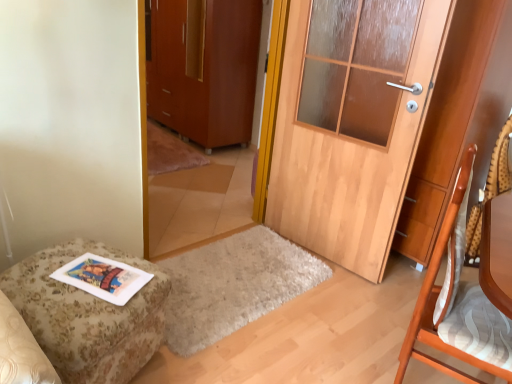
Question: Is wooden chair at right looking in the opposite direction of wooden textured swivel chair at right?

Choices:
 (A) yes
 (B) no

Answer: (B)

Question: Could you tell me if wooden chair at right is facing wooden textured swivel chair at right?

Choices:
 (A) yes
 (B) no

Answer: (B)

Question: Considering the relative sizes of wooden chair at right and wooden textured swivel chair at right in the image provided, is wooden chair at right smaller than wooden textured swivel chair at right?

Choices:
 (A) yes
 (B) no

Answer: (B)

Question: Is wooden chair at right at the right side of wooden textured swivel chair at right?

Choices:
 (A) yes
 (B) no

Answer: (B)

Question: From the image's perspective, does wooden chair at right appear higher than wooden textured swivel chair at right?

Choices:
 (A) no
 (B) yes

Answer: (A)

Question: Is wooden chair at right wider than wooden textured swivel chair at right?

Choices:
 (A) yes
 (B) no

Answer: (A)

Question: Is floral fabric ottoman at lower left next to wooden textured swivel chair at right and touching it?

Choices:
 (A) yes
 (B) no

Answer: (B)

Question: Is floral fabric ottoman at lower left facing away from wooden textured swivel chair at right?

Choices:
 (A) no
 (B) yes

Answer: (A)

Question: Can you confirm if floral fabric ottoman at lower left is positioned to the left of wooden textured swivel chair at right?

Choices:
 (A) no
 (B) yes

Answer: (B)

Question: From a real-world perspective, is floral fabric ottoman at lower left beneath wooden textured swivel chair at right?

Choices:
 (A) yes
 (B) no

Answer: (A)

Question: Does floral fabric ottoman at lower left have a larger size compared to wooden textured swivel chair at right?

Choices:
 (A) no
 (B) yes

Answer: (B)

Question: Is floral fabric ottoman at lower left completely or partially outside of wooden textured swivel chair at right?

Choices:
 (A) yes
 (B) no

Answer: (A)

Question: Can you confirm if floral fabric ottoman at lower left is shorter than matte brown cabinet at center?

Choices:
 (A) yes
 (B) no

Answer: (A)